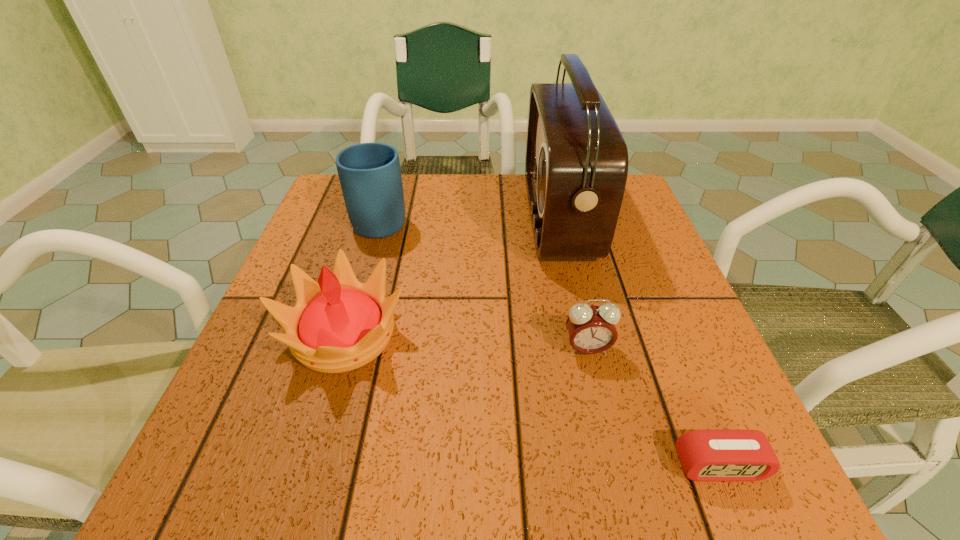
I want to click on object situated at the far left corner, so click(x=370, y=177).

Where is `object present at the far right corner`? object present at the far right corner is located at coordinates (576, 164).

At what (x,y) coordinates should I click in order to perform the action: click on object situated at the near right corner. Please return your answer as a coordinate pair (x, y). This screenshot has width=960, height=540. Looking at the image, I should click on (706, 455).

Image resolution: width=960 pixels, height=540 pixels. In the image, there is a desktop. Identify the location of vacant space at the far edge. (513, 222).

The width and height of the screenshot is (960, 540). In the image, there is a desktop. What are the coordinates of `vacant area at the near edge` in the screenshot? It's located at (341, 462).

Locate an element on the screen. vacant space at the left edge of the desktop is located at coordinates (234, 415).

In the image, there is a desktop. Where is `free space at the right edge`? The height and width of the screenshot is (540, 960). free space at the right edge is located at coordinates (593, 282).

In the image, there is a desktop. Identify the location of vacant space at the far left corner. (328, 184).

Locate an element on the screen. free space at the near right corner is located at coordinates (781, 501).

Identify the location of vacant space in between the taller alarm clock and the crown. (466, 342).